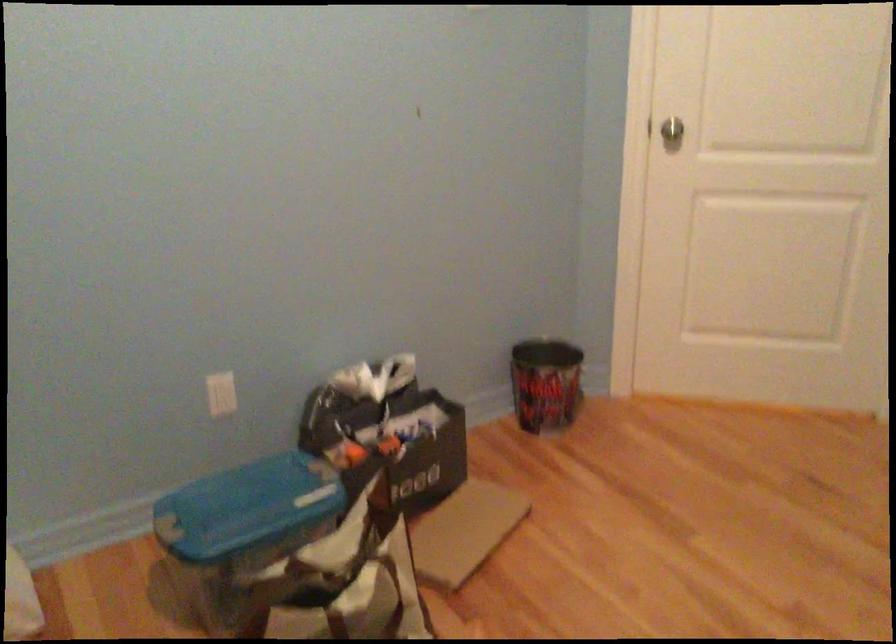
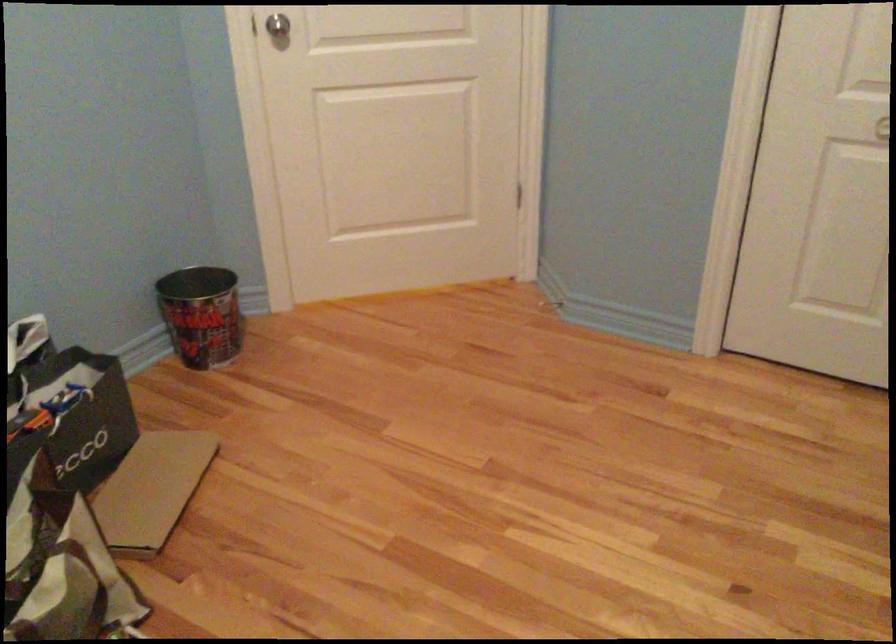
Question: The camera is either moving clockwise (left) or counter-clockwise (right) around the object. The first image is from the beginning of the video and the second image is from the end. Is the camera moving left or right when shooting the video?

Choices:
 (A) Left
 (B) Right

Answer: (A)